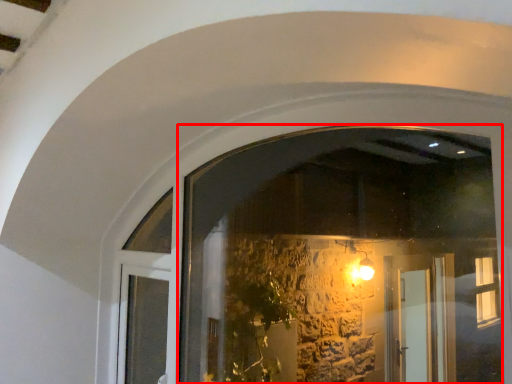
Question: From the image's perspective, what is the correct spatial relationship of window (annotated by the red box) in relation to door?

Choices:
 (A) above
 (B) below

Answer: (A)